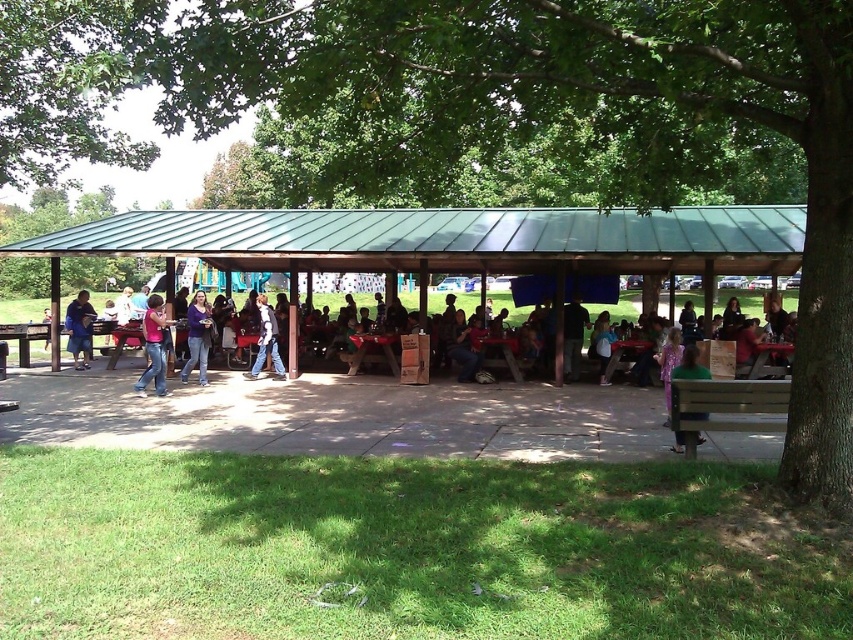
Is point (743, 339) behind point (74, 364)?

That is False.

Can you confirm if matte pink shirt at center is positioned to the left of blue denim jacket at left?

In fact, matte pink shirt at center is to the right of blue denim jacket at left.

Is point (740, 372) closer to viewer compared to point (77, 352)?

Yes, point (740, 372) is closer to viewer.

You are a GUI agent. You are given a task and a screenshot of the screen. Output one action in this format:
    pyautogui.click(x=<x>, y=<y>)
    Task: Click on the matte pink shirt at center
    The height and width of the screenshot is (640, 853).
    Given the screenshot: What is the action you would take?
    pyautogui.click(x=770, y=323)

How distant is wooden park bench at lower right from blue denim jacket at left?

The distance of wooden park bench at lower right from blue denim jacket at left is 40.51 feet.

Locate an element on the screen. wooden park bench at lower right is located at coordinates (726, 406).

Locate an element on the screen. Image resolution: width=853 pixels, height=640 pixels. wooden park bench at lower right is located at coordinates (726, 406).

Does black matte jacket at center have a lesser height compared to denim jacket at center?

Yes, black matte jacket at center is shorter than denim jacket at center.

Find the location of a particular element. black matte jacket at center is located at coordinates (572, 337).